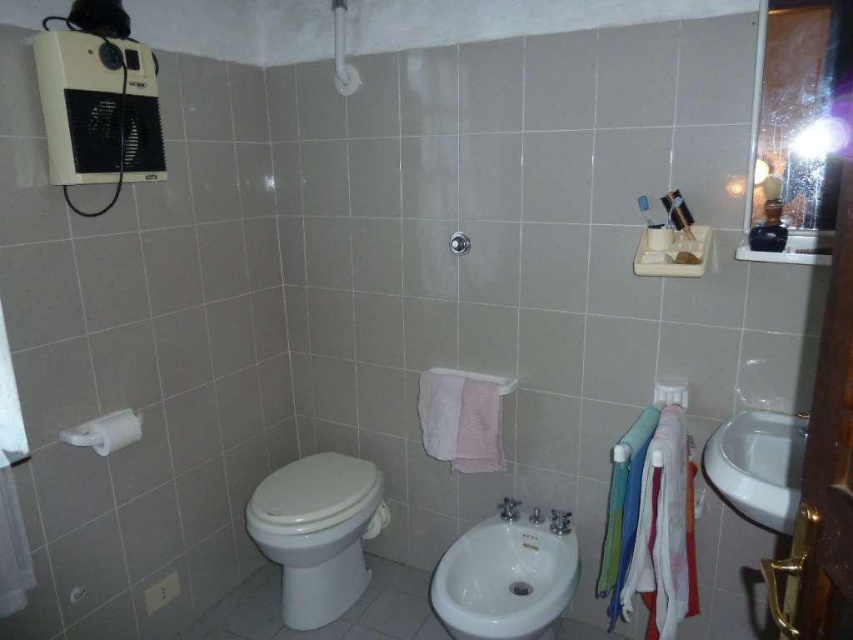
Question: Which is farther from the matte silver shower at upper center?

Choices:
 (A) white glossy toilet at center
 (B) white glossy bidet at center

Answer: (A)

Question: Can you confirm if white glossy sink at right is wider than black plastic toothbrush at upper right?

Choices:
 (A) yes
 (B) no

Answer: (A)

Question: Can you confirm if white glossy sink at right is thinner than matte silver shower at upper center?

Choices:
 (A) yes
 (B) no

Answer: (B)

Question: Among these points, which one is nearest to the camera?

Choices:
 (A) (671, 205)
 (B) (749, 435)

Answer: (B)

Question: Which point is farther to the camera?

Choices:
 (A) (462, 236)
 (B) (729, 481)
 (C) (473, 534)

Answer: (A)

Question: Does white glossy bidet at center appear over white glossy sink at right?

Choices:
 (A) no
 (B) yes

Answer: (A)